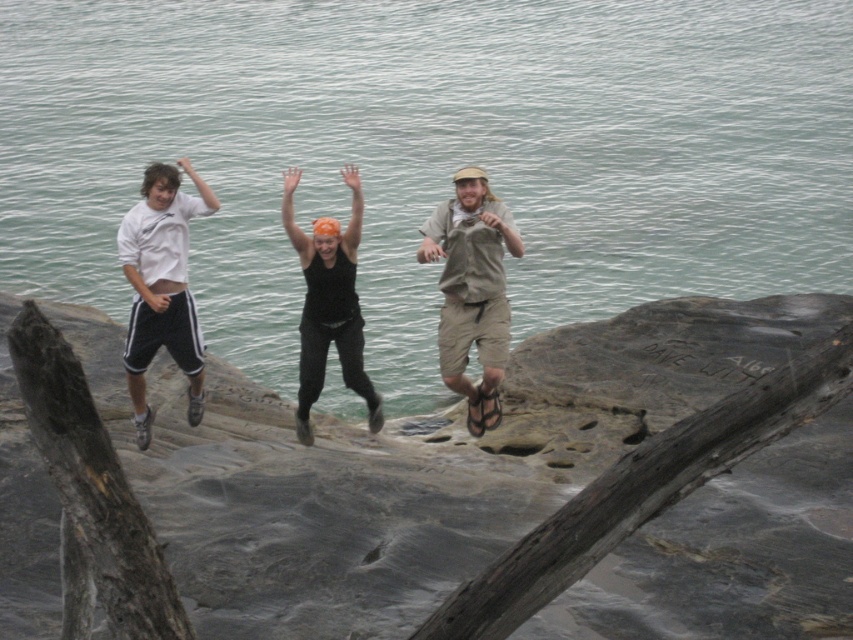
Question: Can you confirm if gray rough rock at center is positioned below khaki cotton shorts at center?

Choices:
 (A) yes
 (B) no

Answer: (A)

Question: Is clear water at center behind black fabric tank top at center?

Choices:
 (A) no
 (B) yes

Answer: (B)

Question: Which point is farther to the camera?

Choices:
 (A) black fabric tank top at center
 (B) white cotton shirt at left

Answer: (A)

Question: Which object appears closest to the camera in this image?

Choices:
 (A) white cotton shirt at left
 (B) khaki cotton shorts at center
 (C) gray rough rock at center
 (D) matte white t-shirt at center

Answer: (C)

Question: Can you confirm if white cotton shirt at left is bigger than black fabric tank top at center?

Choices:
 (A) no
 (B) yes

Answer: (A)

Question: Which point is closer to the camera?

Choices:
 (A) gray rough rock at center
 (B) white cotton shirt at left
 (C) khaki cotton shorts at center

Answer: (A)